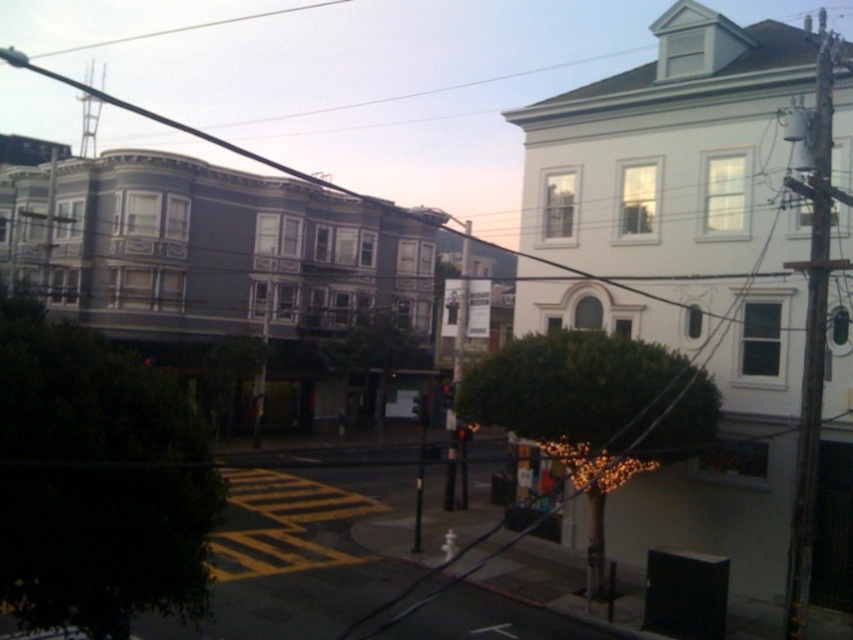
Who is higher up, metallic pole at center or red glass traffic light at center?

metallic pole at center is higher up.

Is point (463, 504) positioned behind point (451, 390)?

No, (463, 504) is closer to viewer.

Which is in front, point (457, 337) or point (451, 397)?

Point (457, 337) is more forward.

I want to click on metallic pole at center, so click(461, 307).

Can you confirm if wooden utility pole at right is shorter than white wire at upper center?

No, wooden utility pole at right is not shorter than white wire at upper center.

At what (x,y) coordinates should I click in order to perform the action: click on wooden utility pole at right. Please return your answer as a coordinate pair (x, y). This screenshot has width=853, height=640. Looking at the image, I should click on (811, 326).

Does point (821, 42) come closer to viewer compared to point (332, 1)?

That is True.

Locate an element on the screen. This screenshot has height=640, width=853. wooden utility pole at right is located at coordinates (811, 326).

Is wooden utility pole at right bigger than red glass traffic light at center?

Indeed, wooden utility pole at right has a larger size compared to red glass traffic light at center.

Is point (821, 330) less distant than point (445, 388)?

Yes.

Where is `wooden utility pole at right`? The image size is (853, 640). wooden utility pole at right is located at coordinates (811, 326).